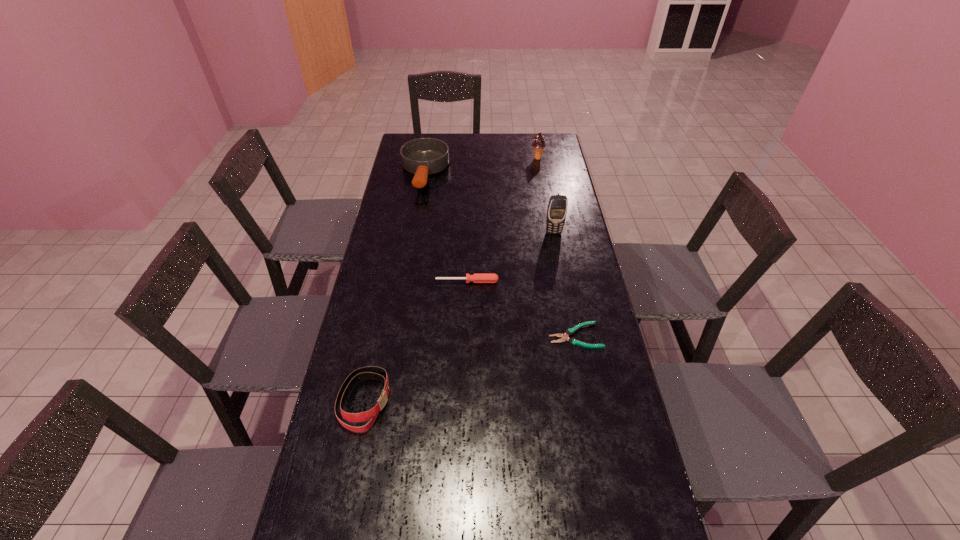
Locate an element on the screen. vacant position located 0.200m on the front face of the tallest object is located at coordinates (562, 273).

Where is `vacant area located 0.400m on the front of the second tallest object`? The image size is (960, 540). vacant area located 0.400m on the front of the second tallest object is located at coordinates (547, 216).

The height and width of the screenshot is (540, 960). Identify the location of vacant space positioned on the handle side of the pan. (416, 227).

The width and height of the screenshot is (960, 540). In order to click on free space located on the back of the dog collar in this screenshot , I will do `click(383, 311)`.

Where is `free space located on the left of the screwdriver`? The height and width of the screenshot is (540, 960). free space located on the left of the screwdriver is located at coordinates (372, 281).

The height and width of the screenshot is (540, 960). I want to click on free space located 0.100m on the back of the pliers, so click(568, 298).

In order to click on icecream located in the far edge section of the desktop in this screenshot , I will do point(538,143).

The height and width of the screenshot is (540, 960). I want to click on pan that is positioned at the far edge, so click(423, 156).

At what (x,y) coordinates should I click in order to perform the action: click on pan that is at the left edge. Please return your answer as a coordinate pair (x, y). Looking at the image, I should click on (423, 156).

Where is `dog collar present at the left edge`? This screenshot has width=960, height=540. dog collar present at the left edge is located at coordinates (371, 371).